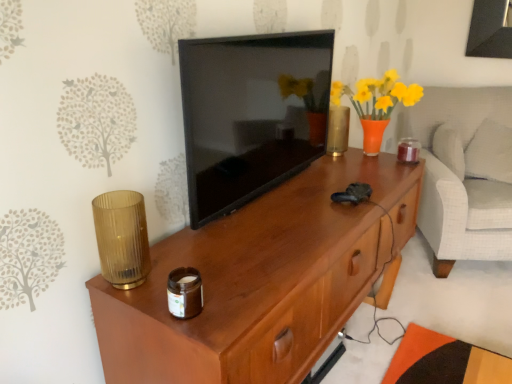
Locate an element on the screen. The image size is (512, 384). free space that is in between black glossy tv at center and brown glass jar at lower center, which is the 1th candle holder from front to back is located at coordinates (238, 238).